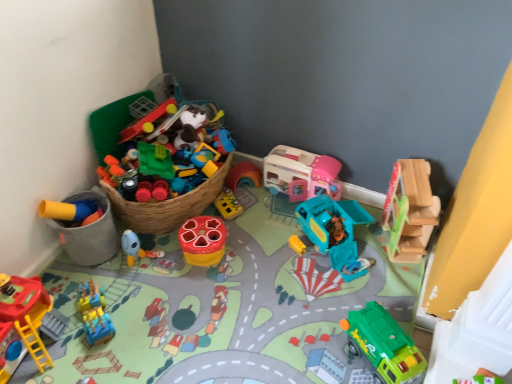
Locate an element on the screen. vacant space that is in between wooden slide at upper right, which is counted as the 8th toy, starting from the left, and teal plastic truck at center, which ranks as the third toy in right-to-left order is located at coordinates (366, 253).